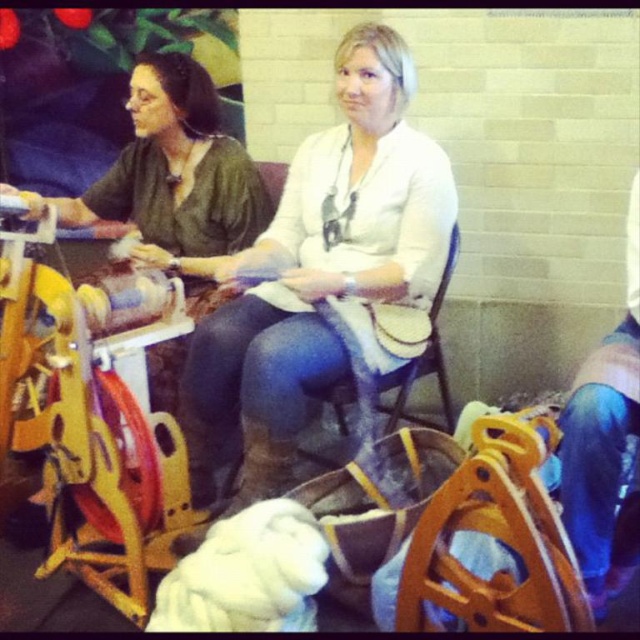
Does white matte sweater at center appear on the right side of wooden chair at center?

Incorrect, white matte sweater at center is not on the right side of wooden chair at center.

Between point (392, 54) and point (385, 432), which one is positioned behind?

The point (385, 432) is behind.

Does point (339, 225) come in front of point (307, 451)?

Yes.

Identify the location of white matte sweater at center. The image size is (640, 640). (321, 273).

Can you confirm if green matte fabric at left is positioned to the left of wooden chair at center?

Indeed, green matte fabric at left is positioned on the left side of wooden chair at center.

Is point (192, 294) farther from camera compared to point (444, 417)?

No, it is not.

At what (x,y) coordinates should I click in order to perform the action: click on green matte fabric at left. Please return your answer as a coordinate pair (x, y). Image resolution: width=640 pixels, height=640 pixels. Looking at the image, I should click on (177, 179).

Does white matte sweater at center have a lesser height compared to green matte fabric at left?

In fact, white matte sweater at center may be taller than green matte fabric at left.

Which of these two, white matte sweater at center or green matte fabric at left, stands shorter?

With less height is green matte fabric at left.

The image size is (640, 640). What do you see at coordinates (321, 273) in the screenshot?
I see `white matte sweater at center` at bounding box center [321, 273].

You are a GUI agent. You are given a task and a screenshot of the screen. Output one action in this format:
    pyautogui.click(x=<x>, y=<y>)
    Task: Click on the white matte sweater at center
    
    Given the screenshot: What is the action you would take?
    pyautogui.click(x=321, y=273)